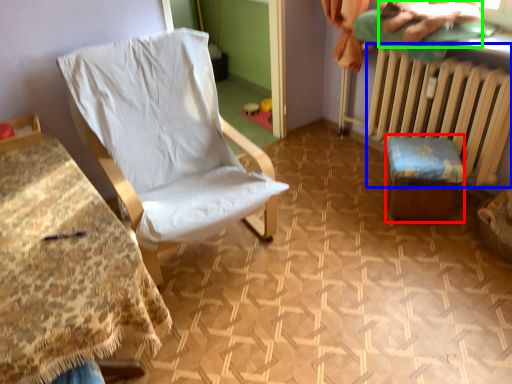
Question: Estimate the real-world distances between objects in this image. Which object is closer to furniture (highlighted by a red box), radiator (highlighted by a blue box) or fabric (highlighted by a green box)?

Choices:
 (A) radiator
 (B) fabric

Answer: (A)